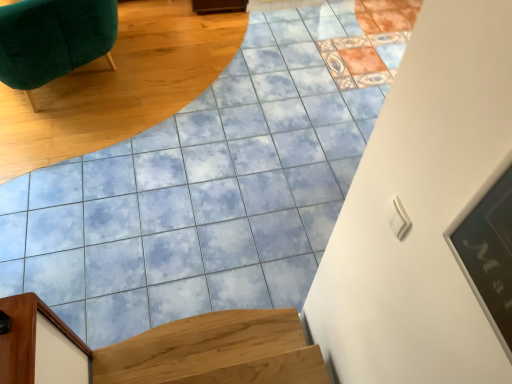
Question: Considering the relative sizes of light brown wood stairs at lower left and wooden door frame at lower left, which is the first furniture in right-to-left order, in the image provided, is light brown wood stairs at lower left taller than wooden door frame at lower left, which is the first furniture in right-to-left order,?

Choices:
 (A) yes
 (B) no

Answer: (B)

Question: Is light brown wood stairs at lower left aimed at wooden door frame at lower left, positioned as the second furniture in top-to-bottom order?

Choices:
 (A) yes
 (B) no

Answer: (B)

Question: Is light brown wood stairs at lower left not close to wooden door frame at lower left, the first furniture in the bottom-to-top sequence?

Choices:
 (A) yes
 (B) no

Answer: (B)

Question: Is light brown wood stairs at lower left closer to camera compared to wooden door frame at lower left, positioned as the second furniture in back-to-front order?

Choices:
 (A) no
 (B) yes

Answer: (A)

Question: From a real-world perspective, is light brown wood stairs at lower left located higher than wooden door frame at lower left, which appears as the 1th furniture when viewed from the front?

Choices:
 (A) yes
 (B) no

Answer: (B)

Question: Can you confirm if light brown wood stairs at lower left is smaller than wooden door frame at lower left, which is the first furniture in right-to-left order?

Choices:
 (A) yes
 (B) no

Answer: (B)

Question: From a real-world perspective, is light brown wood stairs at lower left on top of velvet green chair at upper left, the first furniture when ordered from top to bottom?

Choices:
 (A) yes
 (B) no

Answer: (B)

Question: Is light brown wood stairs at lower left facing away from velvet green chair at upper left, which ranks as the 2th furniture in bottom-to-top order?

Choices:
 (A) yes
 (B) no

Answer: (B)

Question: Considering the relative positions of light brown wood stairs at lower left and velvet green chair at upper left, the 2th furniture positioned from the right, in the image provided, is light brown wood stairs at lower left in front of velvet green chair at upper left, the 2th furniture positioned from the right,?

Choices:
 (A) no
 (B) yes

Answer: (B)

Question: Does light brown wood stairs at lower left have a lesser width compared to velvet green chair at upper left, which is the first furniture in left-to-right order?

Choices:
 (A) no
 (B) yes

Answer: (B)

Question: Can you confirm if light brown wood stairs at lower left is wider than velvet green chair at upper left, which is the first furniture in left-to-right order?

Choices:
 (A) yes
 (B) no

Answer: (B)

Question: Considering the relative sizes of light brown wood stairs at lower left and velvet green chair at upper left, which is the first furniture in left-to-right order, in the image provided, is light brown wood stairs at lower left shorter than velvet green chair at upper left, which is the first furniture in left-to-right order,?

Choices:
 (A) yes
 (B) no

Answer: (A)

Question: Is velvet green chair at upper left, positioned as the second furniture in front-to-back order, far from wooden door frame at lower left, which appears as the 1th furniture when viewed from the front?

Choices:
 (A) no
 (B) yes

Answer: (B)